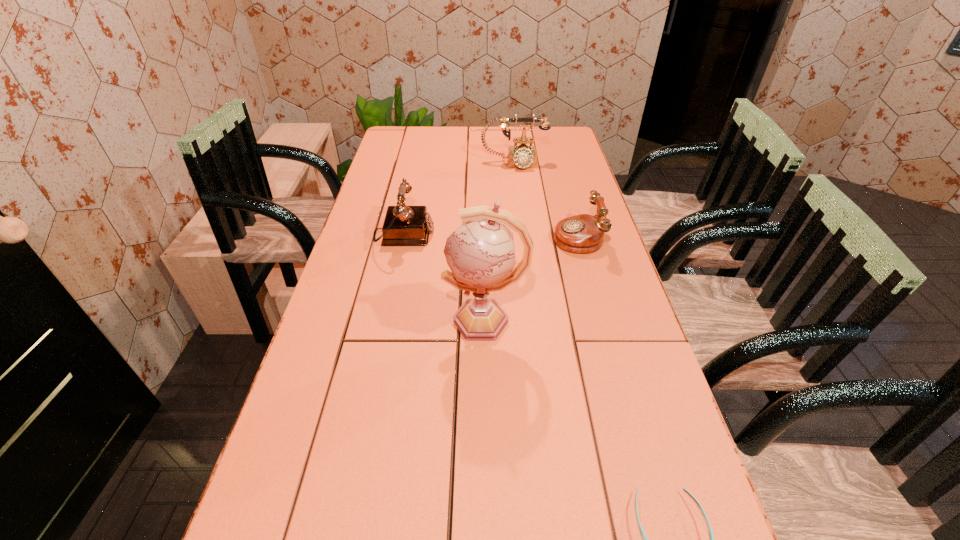
The image size is (960, 540). Find the location of `vacant point that satisfies the following two spatial constraints: 1. on the dial number of the tallest telephone; 2. on the front-facing side of the globe`. vacant point that satisfies the following two spatial constraints: 1. on the dial number of the tallest telephone; 2. on the front-facing side of the globe is located at coordinates (533, 321).